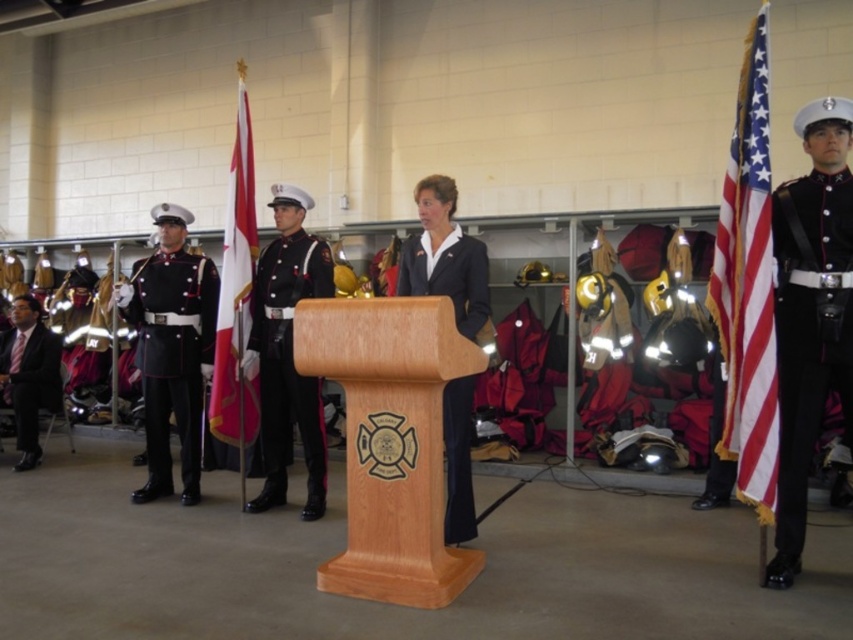
The width and height of the screenshot is (853, 640). Describe the element at coordinates (172, 358) in the screenshot. I see `shiny black uniform at left` at that location.

Consider the image. Between shiny black uniform at left and black smooth suit at left, which one is positioned lower?

black smooth suit at left is below.

Locate an element on the screen. The image size is (853, 640). shiny black uniform at left is located at coordinates coord(172,358).

Find the location of a particular element. This screenshot has width=853, height=640. shiny black uniform at left is located at coordinates (172, 358).

Can you confirm if black glossy uniform at right is shorter than navy blue fabric uniform at center?

No.

Consider the image. Between black glossy uniform at right and navy blue fabric uniform at center, which one appears on the left side from the viewer's perspective?

navy blue fabric uniform at center

The image size is (853, 640). I want to click on black glossy uniform at right, so click(809, 330).

Can you confirm if black glossy uniform at right is positioned to the right of red fabric flag at center?

Yes, black glossy uniform at right is to the right of red fabric flag at center.

Can you confirm if black glossy uniform at right is shorter than red fabric flag at center?

Correct, black glossy uniform at right is not as tall as red fabric flag at center.

What do you see at coordinates (809, 330) in the screenshot? I see `black glossy uniform at right` at bounding box center [809, 330].

Find the location of a particular element. black glossy uniform at right is located at coordinates (809, 330).